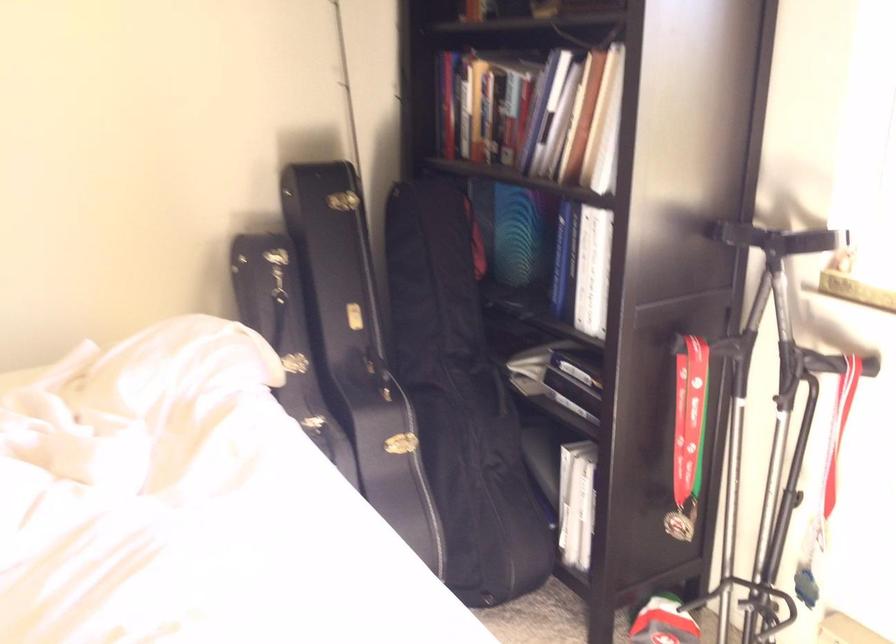
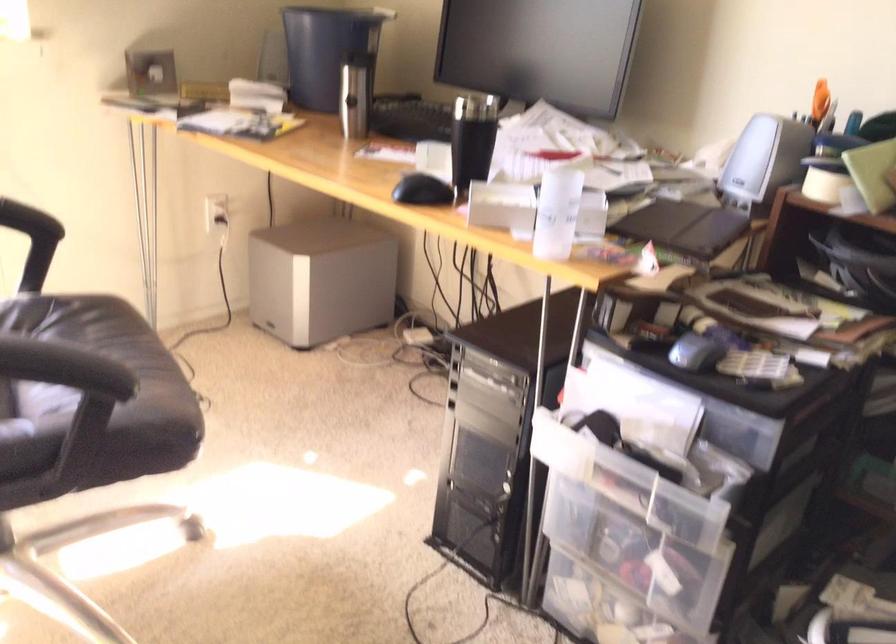
The first image is from the beginning of the video and the second image is from the end. How did the camera likely rotate when shooting the video?

The camera rotated toward right-down.